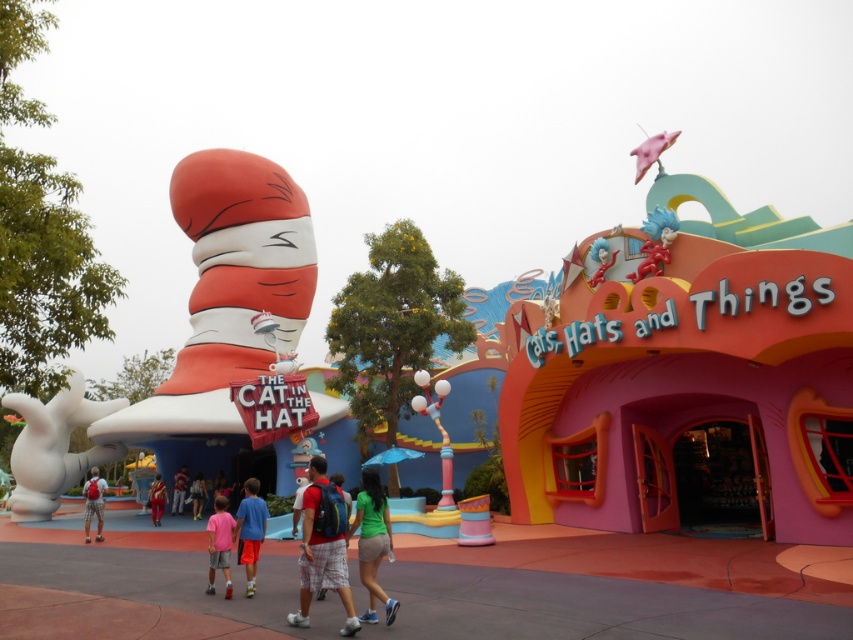
Is blue fabric shorts at center to the right of light blue denim shorts at center from the viewer's perspective?

Correct, you'll find blue fabric shorts at center to the right of light blue denim shorts at center.

Who is more distant from viewer, (x=238, y=515) or (x=187, y=477)?

Positioned behind is point (x=187, y=477).

Locate an element on the screen. blue fabric shorts at center is located at coordinates (250, 531).

Who is positioned more to the right, pink fabric shorts at lower center or matte gray shorts at center?

pink fabric shorts at lower center

Between point (221, 547) and point (86, 524), which one is positioned behind?

The point (86, 524) is more distant.

Which is in front, point (210, 572) or point (103, 484)?

Point (210, 572)

This screenshot has height=640, width=853. Identify the location of pink fabric shorts at lower center. (219, 545).

Between matte red shorts at center and orange fabric pants at center, which one is positioned lower?

orange fabric pants at center is below.

Who is positioned more to the left, matte red shorts at center or orange fabric pants at center?

Positioned to the left is orange fabric pants at center.

Is point (340, 560) behind point (151, 506)?

No, (340, 560) is closer to viewer.

This screenshot has height=640, width=853. Identify the location of matte red shorts at center. (320, 554).